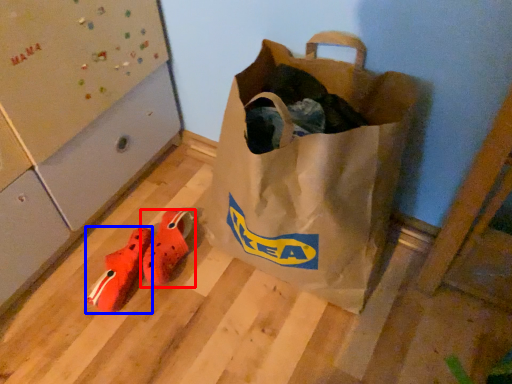
Question: Which object appears farthest to the camera in this image, footwear (highlighted by a red box) or shoe (highlighted by a blue box)?

Choices:
 (A) footwear
 (B) shoe

Answer: (A)